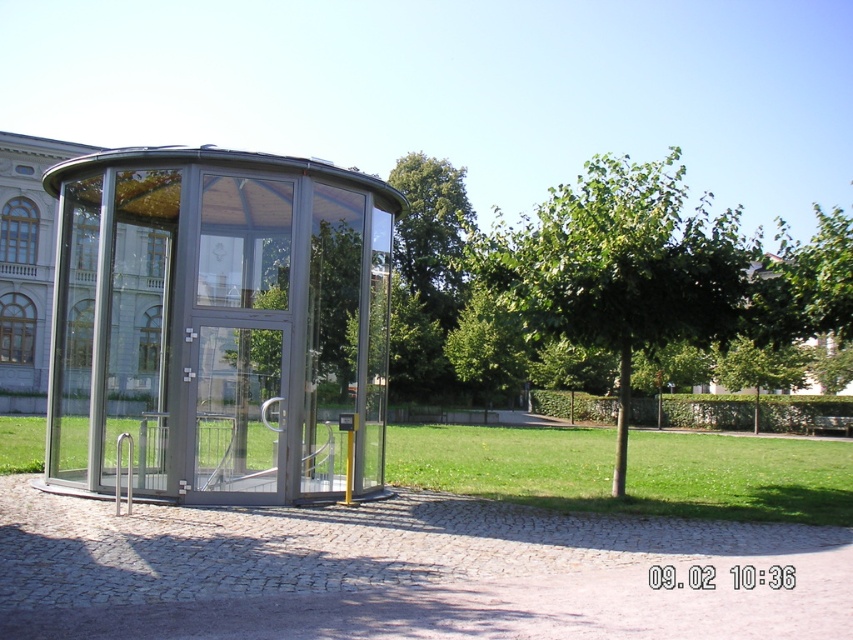
Can you confirm if transparent glass gazebo at center is bigger than green leafy tree at center?

No, transparent glass gazebo at center is not bigger than green leafy tree at center.

Does transparent glass gazebo at center lie behind green leafy tree at center?

No, transparent glass gazebo at center is closer to the viewer.

Is point (152, 150) more distant than point (556, 193)?

No, (152, 150) is in front of (556, 193).

Identify the location of transparent glass gazebo at center. (218, 323).

Between point (619, 285) and point (247, 301), which one is positioned in front?

Point (619, 285) is in front.

Who is more forward, (607, 312) or (286, 413)?

Positioned in front is point (286, 413).

Locate an element on the screen. green leafy tree at center is located at coordinates (621, 266).

Based on the photo, is transparent glass gazebo at center further to camera compared to transparent glass door at center?

No.

The width and height of the screenshot is (853, 640). In order to click on transparent glass gazebo at center in this screenshot , I will do `click(218, 323)`.

Find the location of a particular element. Image resolution: width=853 pixels, height=640 pixels. transparent glass gazebo at center is located at coordinates (218, 323).